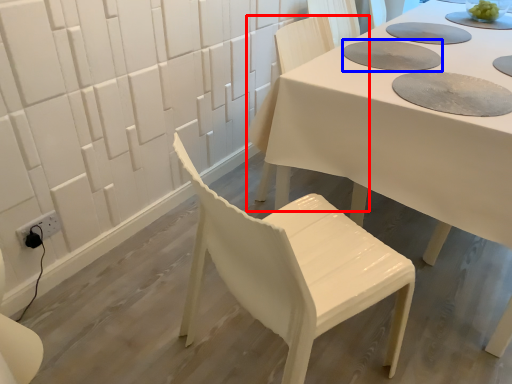
Question: Among these objects, which one is nearest to the camera, chair (highlighted by a red box) or paper plate (highlighted by a blue box)?

Choices:
 (A) chair
 (B) paper plate

Answer: (B)